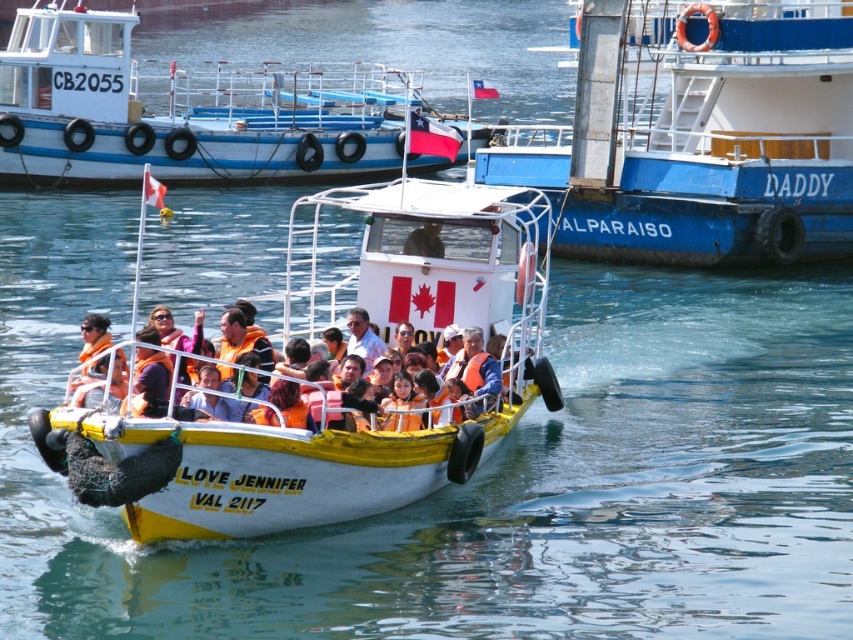
Which is more to the right, blue painted metal boat at upper right or orange life vest at center?

blue painted metal boat at upper right is more to the right.

Does blue painted metal boat at upper right appear over orange life vest at center?

Yes, blue painted metal boat at upper right is above orange life vest at center.

Find the location of a particular element. The height and width of the screenshot is (640, 853). blue painted metal boat at upper right is located at coordinates (701, 134).

Can you confirm if white/yellow plastic boat at center is taller than orange life vest at center?

Yes.

Which of these two, white/yellow plastic boat at center or orange life vest at center, stands taller?

Standing taller between the two is white/yellow plastic boat at center.

Who is more forward, (410, 284) or (96, 406)?

Positioned in front is point (96, 406).

At what (x,y) coordinates should I click in order to perform the action: click on white/yellow plastic boat at center. Please return your answer as a coordinate pair (x, y). This screenshot has height=640, width=853. Looking at the image, I should click on (334, 392).

Can you confirm if white/yellow plastic boat at center is bigger than white matte boat at upper center?

No.

Who is positioned more to the left, white/yellow plastic boat at center or white matte boat at upper center?

From the viewer's perspective, white matte boat at upper center appears more on the left side.

Is point (357, 461) more distant than point (177, 83)?

No, it is not.

Find the location of a particular element. The height and width of the screenshot is (640, 853). white/yellow plastic boat at center is located at coordinates (334, 392).